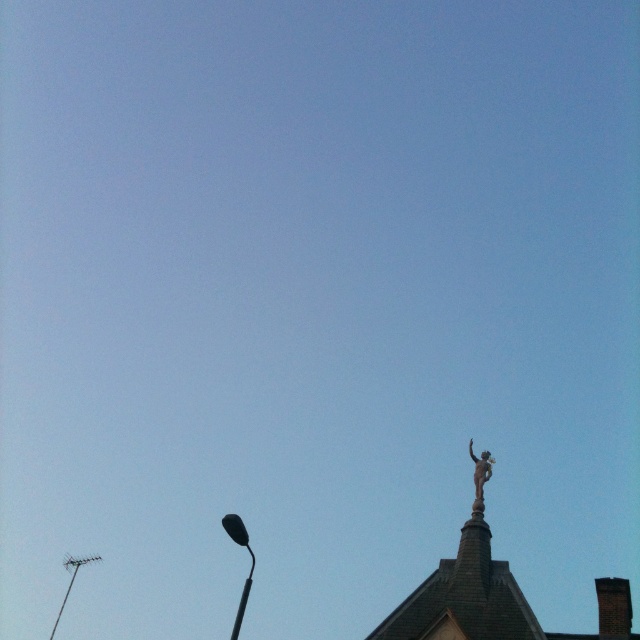
Question: Can you confirm if bronze statue at upper right is positioned below metallic streetlight at lower left?

Choices:
 (A) yes
 (B) no

Answer: (B)

Question: Which of the following is the farthest from the observer?

Choices:
 (A) black glossy street light at lower left
 (B) metallic streetlight at lower left
 (C) bronze statue at upper right

Answer: (B)

Question: Among these objects, which one is farthest from the camera?

Choices:
 (A) black glossy street light at lower left
 (B) bronze statue at upper right

Answer: (B)

Question: Does black glossy street light at lower left appear over metallic streetlight at lower left?

Choices:
 (A) yes
 (B) no

Answer: (A)

Question: Estimate the real-world distances between objects in this image. Which object is closer to the bronze statue at upper right?

Choices:
 (A) metallic streetlight at lower left
 (B) black glossy street light at lower left

Answer: (B)

Question: From the image, what is the correct spatial relationship of black glossy street light at lower left in relation to metallic streetlight at lower left?

Choices:
 (A) left
 (B) right

Answer: (B)